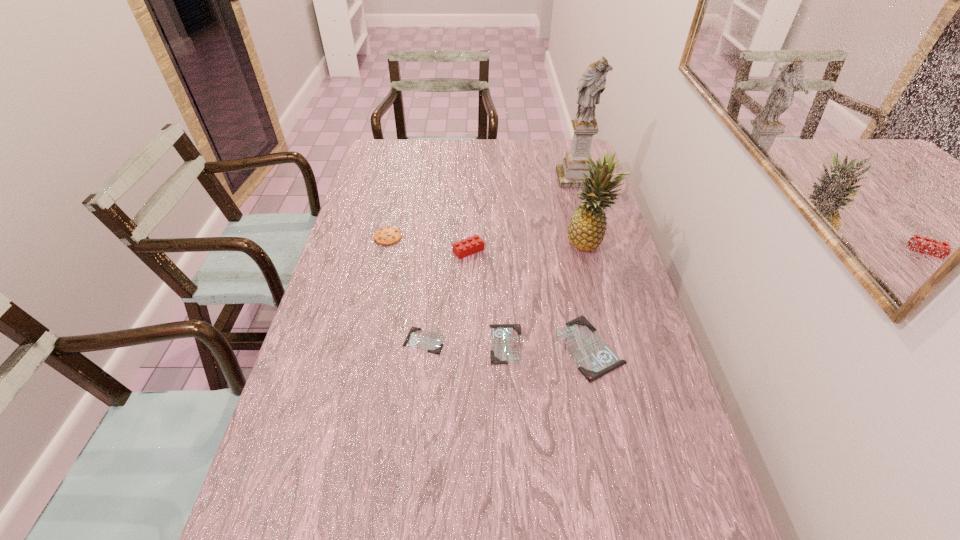
The height and width of the screenshot is (540, 960). Identify the location of the fifth object from right to left. (471, 245).

Find the location of a particular element. The image size is (960, 540). the fifth shortest object is located at coordinates (471, 245).

I want to click on the second tallest object, so click(x=586, y=230).

This screenshot has height=540, width=960. I want to click on vacant point located on the back of the shortest object, so click(x=436, y=232).

Identify the location of vacant space located 0.350m on the back of the fourth object from right to left. (500, 241).

Where is `vacant space located on the left of the fifth tallest object`? vacant space located on the left of the fifth tallest object is located at coordinates (412, 347).

The width and height of the screenshot is (960, 540). Find the location of `vacant space located on the front-facing side of the sculpture`. vacant space located on the front-facing side of the sculpture is located at coordinates (588, 223).

At what (x,y) coordinates should I click in order to perform the action: click on vacant position located 0.250m on the right of the cookie. Please return your answer as a coordinate pair (x, y). Looking at the image, I should click on (478, 237).

Image resolution: width=960 pixels, height=540 pixels. In order to click on vacant space located on the left of the Lego in this screenshot , I will do `click(396, 251)`.

Where is `vacant space located 0.290m on the front of the sixth shortest object`? This screenshot has width=960, height=540. vacant space located 0.290m on the front of the sixth shortest object is located at coordinates (612, 332).